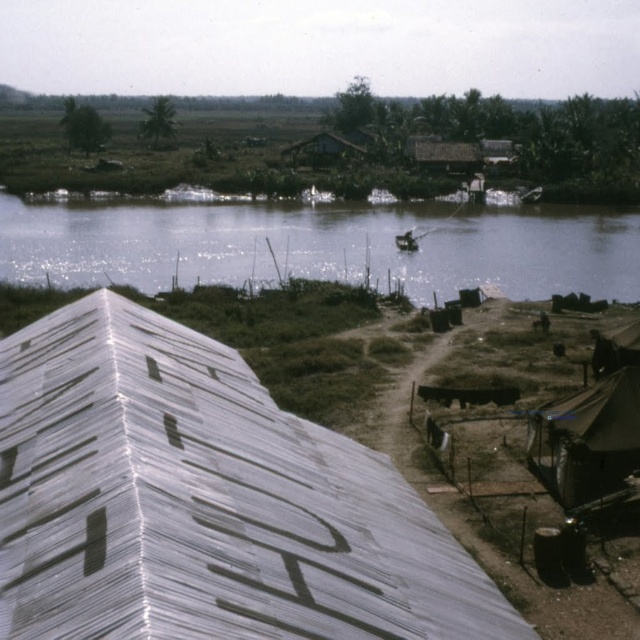
Question: Which object is positioned closest to the dark brown canvas tent at lower right?

Choices:
 (A) clear water at center
 (B) metallic corrugated roof at upper left

Answer: (B)

Question: Which of the following is the farthest from the observer?

Choices:
 (A) clear water at center
 (B) metallic corrugated roof at upper left

Answer: (A)

Question: Can you confirm if clear water at center is smaller than dark brown canvas tent at lower right?

Choices:
 (A) yes
 (B) no

Answer: (B)

Question: Can you confirm if clear water at center is positioned above dark brown canvas tent at lower right?

Choices:
 (A) no
 (B) yes

Answer: (B)

Question: Can you confirm if metallic corrugated roof at upper left is wider than clear water at center?

Choices:
 (A) no
 (B) yes

Answer: (A)

Question: Which point is closer to the camera?

Choices:
 (A) dark brown canvas tent at lower right
 (B) clear water at center

Answer: (A)